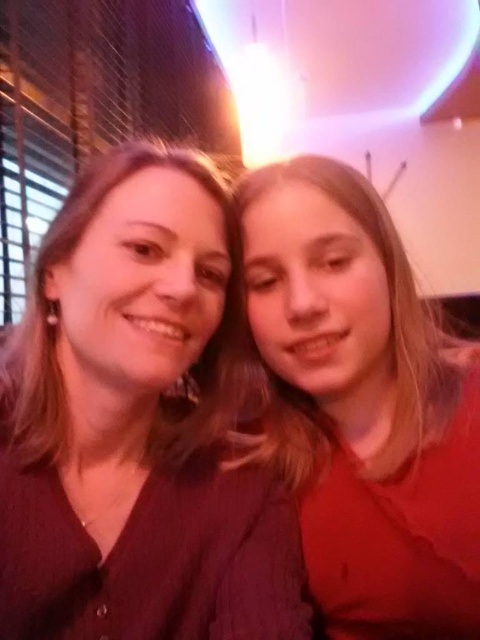
Does matte brown shirt at center appear over matte red shirt at right?

No.

Does matte brown shirt at center have a greater width compared to matte red shirt at right?

Yes, matte brown shirt at center is wider than matte red shirt at right.

Find the location of `matte brown shirt at center`. matte brown shirt at center is located at coordinates (135, 426).